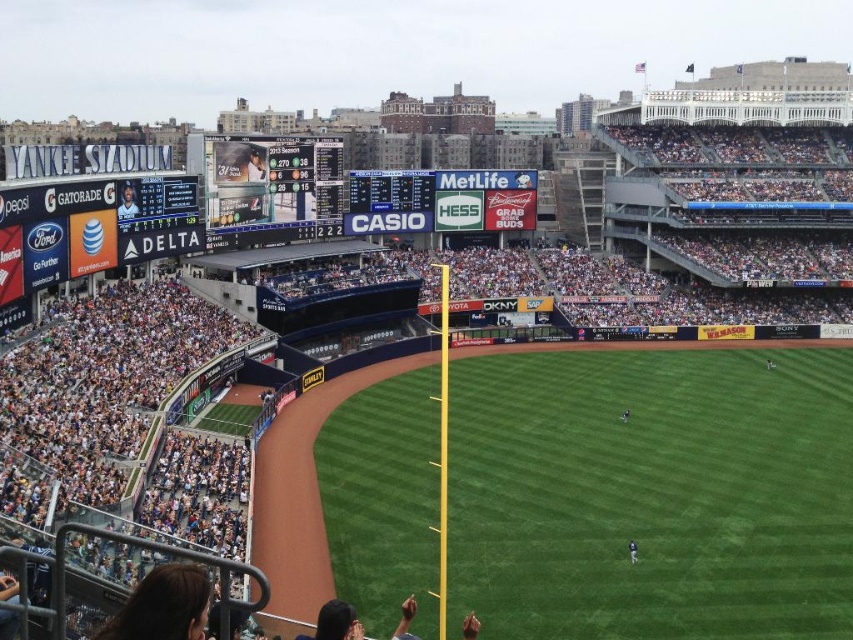
Based on the photo, measure the distance between blue plastic scoreboard at center and dark blue jersey at center.

82.07 meters

Who is more forward, (x=527, y=177) or (x=631, y=550)?

Point (x=631, y=550) is more forward.

The width and height of the screenshot is (853, 640). Find the location of `blue plastic scoreboard at center`. blue plastic scoreboard at center is located at coordinates (440, 200).

Is point (120, 204) behind point (630, 556)?

Yes, it is behind point (630, 556).

Does point (128, 211) come closer to viewer compared to point (631, 556)?

No, (128, 211) is further to viewer.

Locate an element on the screen. matte black jersey at upper left is located at coordinates (126, 202).

Is matte digital scoreboard at upper center to the left of dark blue jersey at center from the viewer's perspective?

Indeed, matte digital scoreboard at upper center is positioned on the left side of dark blue jersey at center.

Measure the distance between matte digital scoreboard at upper center and dark blue jersey at center.

matte digital scoreboard at upper center and dark blue jersey at center are 71.45 meters apart from each other.

The image size is (853, 640). What do you see at coordinates (270, 189) in the screenshot?
I see `matte digital scoreboard at upper center` at bounding box center [270, 189].

This screenshot has width=853, height=640. Find the location of `matte digital scoreboard at upper center`. matte digital scoreboard at upper center is located at coordinates (270, 189).